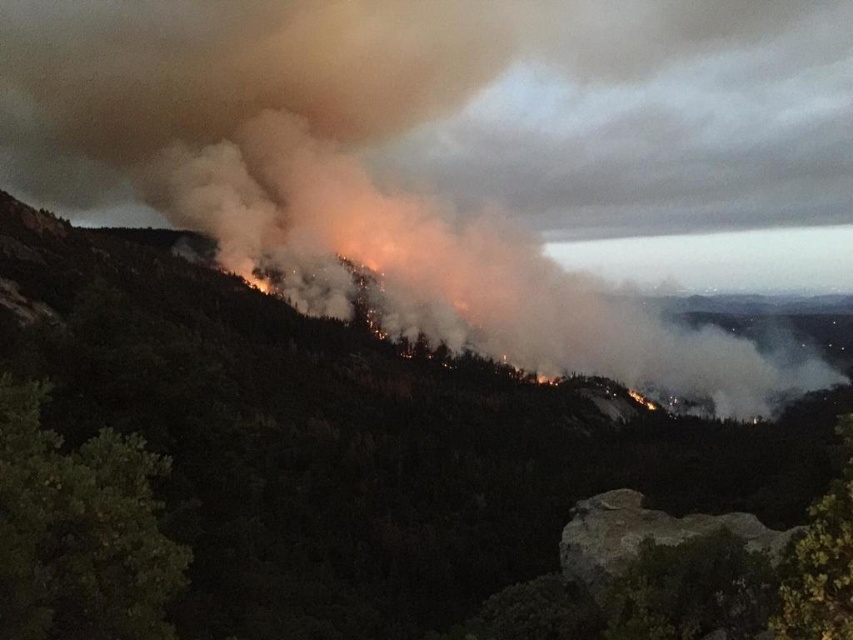
Question: Can you confirm if smoky green forest at center is positioned above smoke/dense at upper center?

Choices:
 (A) yes
 (B) no

Answer: (B)

Question: Which object appears farthest from the camera in this image?

Choices:
 (A) smoke/dense at upper center
 (B) smoky green forest at center

Answer: (A)

Question: Which object appears closest to the camera in this image?

Choices:
 (A) smoky green forest at center
 (B) smoke/dense at upper center

Answer: (A)

Question: Which of the following is the farthest from the observer?

Choices:
 (A) (76, 381)
 (B) (442, 236)

Answer: (B)

Question: Does smoky green forest at center appear on the right side of smoke/dense at upper center?

Choices:
 (A) no
 (B) yes

Answer: (A)

Question: Does smoky green forest at center appear on the right side of smoke/dense at upper center?

Choices:
 (A) no
 (B) yes

Answer: (A)